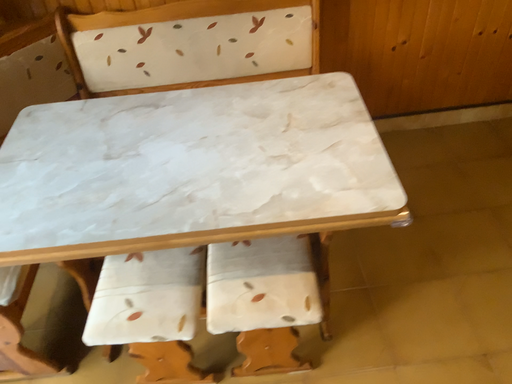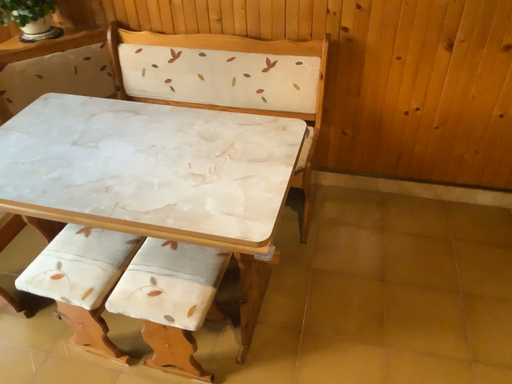
Question: How did the camera likely rotate when shooting the video?

Choices:
 (A) rotated right
 (B) rotated left

Answer: (B)